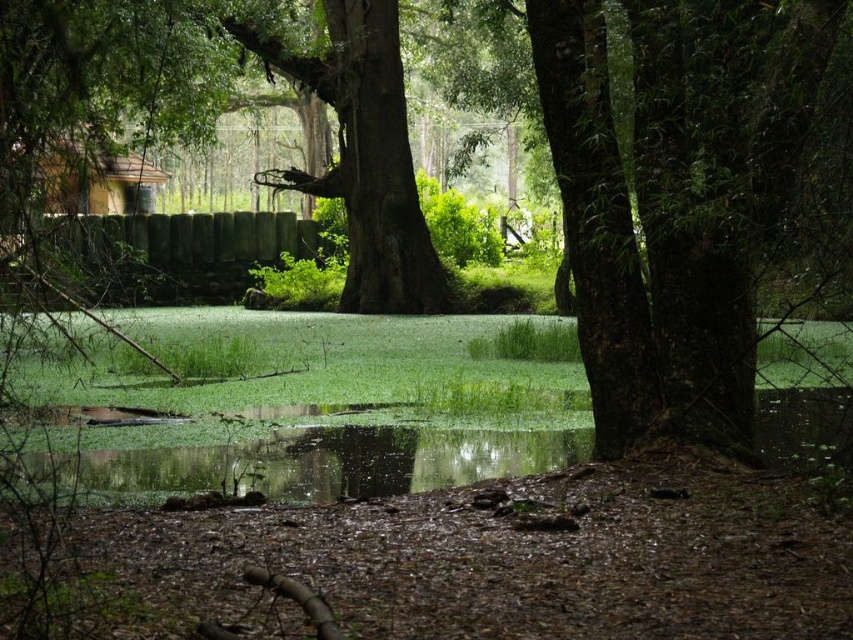
Which of these two, smooth brown tree trunk at center or green algae water at center, stands shorter?

Standing shorter between the two is green algae water at center.

The image size is (853, 640). Describe the element at coordinates (364, 157) in the screenshot. I see `smooth brown tree trunk at center` at that location.

Is point (344, 284) behind point (303, 436)?

Yes, point (344, 284) is farther from viewer.

Where is `smooth brown tree trunk at center`? smooth brown tree trunk at center is located at coordinates (364, 157).

Is green textured bark at right above smooth brown tree trunk at center?

No, green textured bark at right is not above smooth brown tree trunk at center.

Who is more distant from viewer, (732, 154) or (350, 294)?

Positioned behind is point (350, 294).

Where is `green textured bark at right`? green textured bark at right is located at coordinates coord(675,200).

The image size is (853, 640). I want to click on green textured bark at right, so click(x=675, y=200).

Who is shorter, green textured bark at right or green algae water at center?

green algae water at center

Between green textured bark at right and green algae water at center, which one is positioned higher?

green textured bark at right

Which is in front, point (734, 22) or point (305, 440)?

Point (734, 22)

The width and height of the screenshot is (853, 640). Identify the location of green textured bark at right. (675, 200).